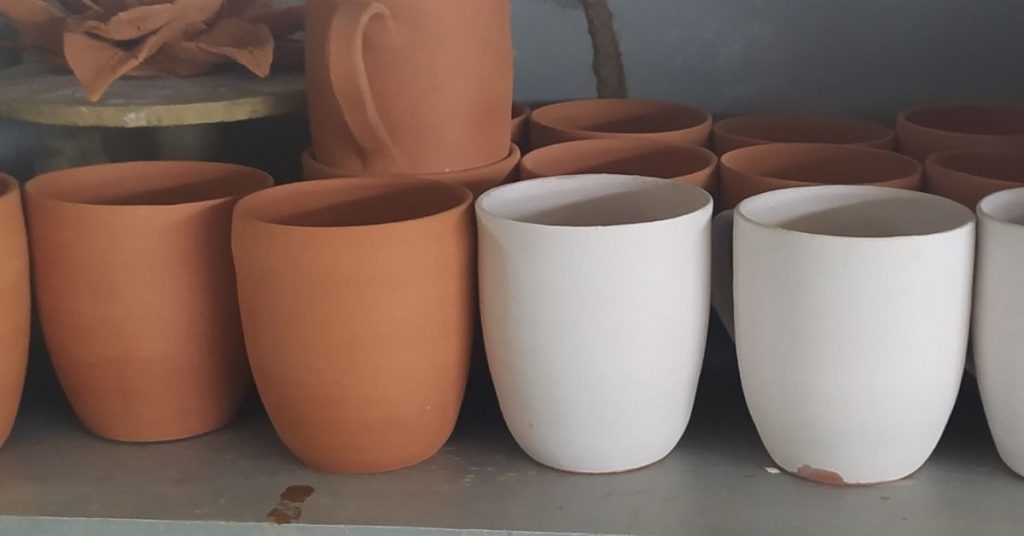
The width and height of the screenshot is (1024, 536). I want to click on shelf, so click(x=231, y=111).